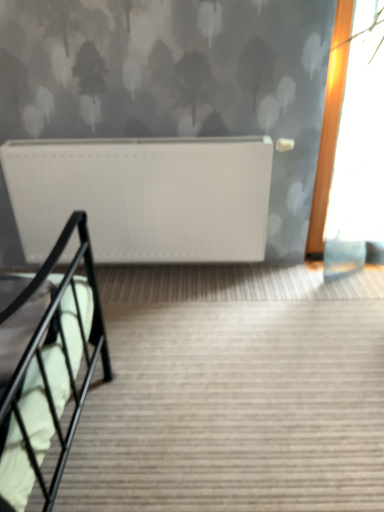
The height and width of the screenshot is (512, 384). Identify the location of vacant space in white matte radiator at upper center (from a real-world perspective). (158, 269).